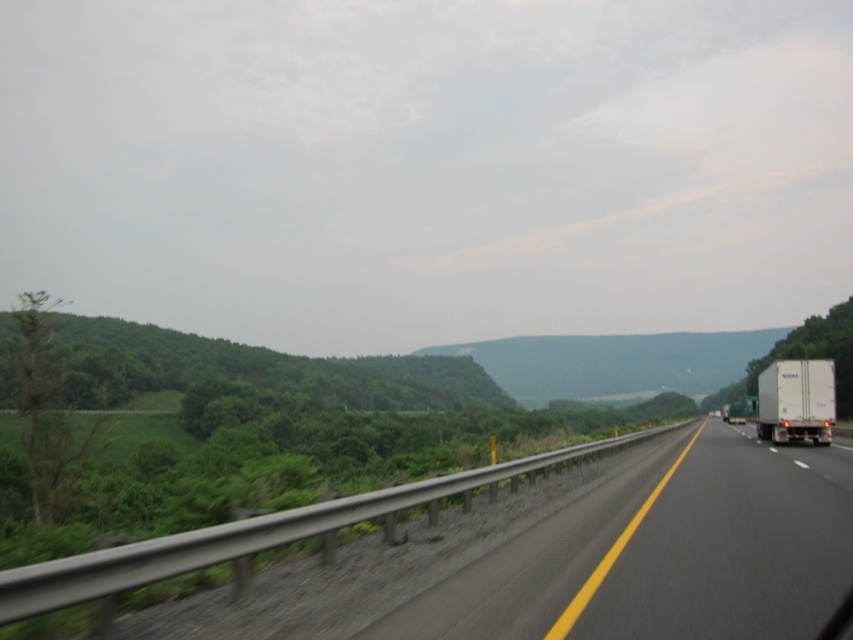
Is black asphalt highway at center wider than white matte trailer truck at right?

No, black asphalt highway at center is not wider than white matte trailer truck at right.

Is black asphalt highway at center above white matte trailer truck at right?

Actually, black asphalt highway at center is below white matte trailer truck at right.

Between point (715, 506) and point (799, 424), which one is positioned in front?

Positioned in front is point (715, 506).

Locate an element on the screen. This screenshot has height=640, width=853. black asphalt highway at center is located at coordinates (665, 554).